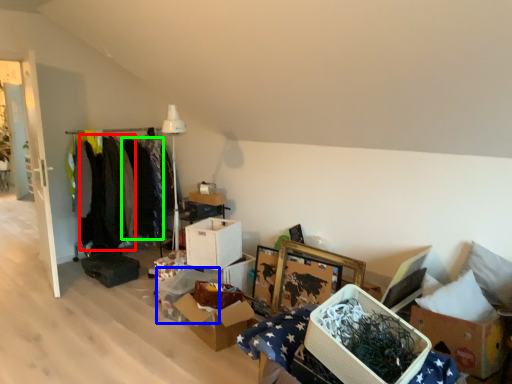
Question: Which is farther away from clothing (highlighted by a red box)? storage box (highlighted by a blue box) or clothing (highlighted by a green box)?

Choices:
 (A) storage box
 (B) clothing

Answer: (A)